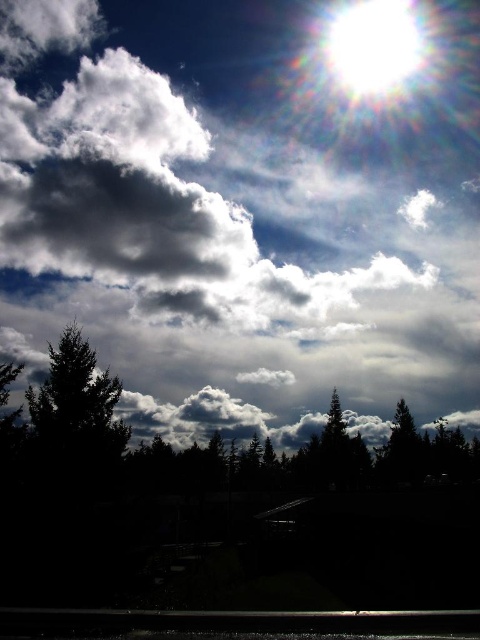
From the picture: You are an artist trying to sketch the scene. You need to decide which object to draw first based on their sizes. Which object should you start with, the dark green textured tree at left or the white glossy sun at upper center?

The dark green textured tree at left is thinner than the white glossy sun at upper center, so you should start with the smaller dark green textured tree at left to ensure proper scaling before drawing the larger white glossy sun at upper center.

You are an astronomer observing the sky and notice the bright white sun at upper center and the green matte tree at lower right. Which object appears bigger in the sky?

The bright white sun at upper center appears bigger in the sky than the green matte tree at lower right because it is larger in size according to the description.

You are standing in the forest depicted in the scene. You see a bright sun in the upper right corner and a point marked at coordinates (75, 412). Which object is closer to you, the bright sun in the upper right corner or the point on the dark green textured tree at left?

The point on the dark green textured tree at left is closer to you because it is part of the foreground elements, while the bright sun in the upper right corner is positioned in the sky background.